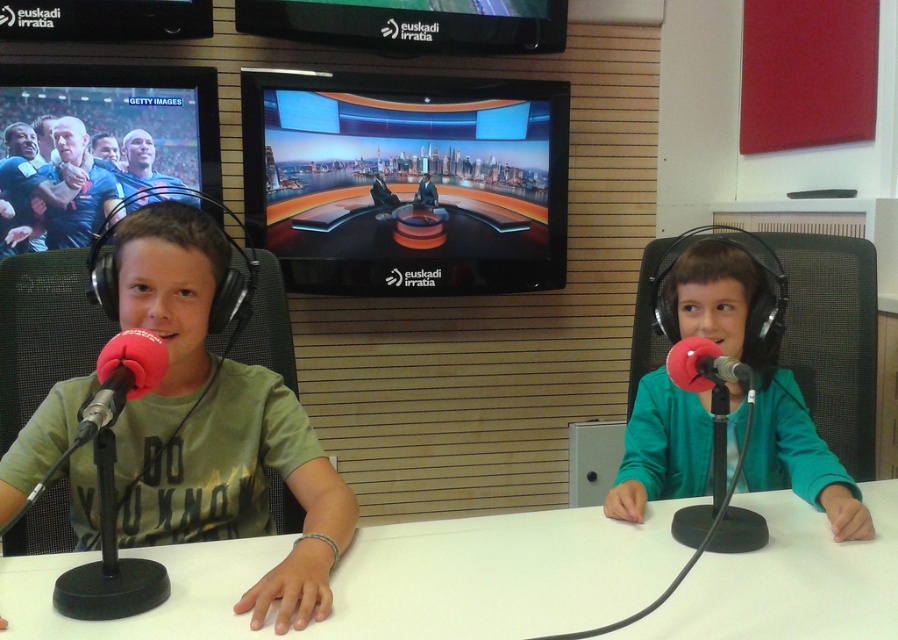
Question: Which object is the closest to the matte green shirt at left?

Choices:
 (A) red foam microphone at left
 (B) red foam microphone at right
 (C) shiny glass desk at center
 (D) green matte jacket at right

Answer: (A)

Question: Among these points, which one is farthest from the camera?

Choices:
 (A) (803, 525)
 (B) (684, 356)
 (C) (113, 362)
 (D) (839, 486)

Answer: (D)

Question: Does shiny glass desk at center have a larger size compared to red foam microphone at right?

Choices:
 (A) no
 (B) yes

Answer: (B)

Question: Is white matte table at center to the right of matte green shirt at left from the viewer's perspective?

Choices:
 (A) yes
 (B) no

Answer: (A)

Question: Which object appears closest to the camera in this image?

Choices:
 (A) green matte jacket at right
 (B) shiny glass desk at center
 (C) matte green shirt at left

Answer: (C)

Question: Does matte green shirt at left come behind red foam microphone at left?

Choices:
 (A) yes
 (B) no

Answer: (A)